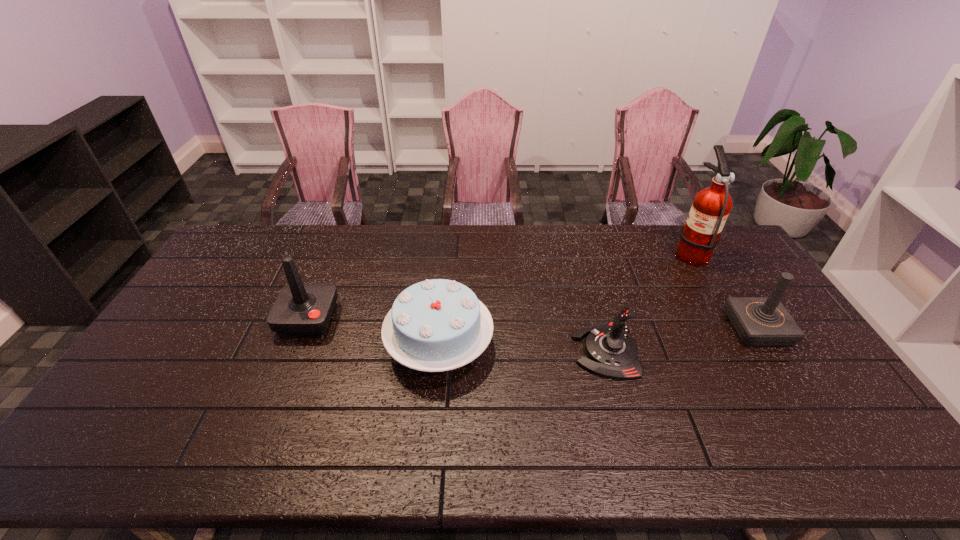
Where is `joystick that is positioned at the right edge`? Image resolution: width=960 pixels, height=540 pixels. joystick that is positioned at the right edge is located at coordinates [759, 321].

Find the location of a particular element. object present at the far right corner is located at coordinates (701, 234).

This screenshot has width=960, height=540. Find the location of `vacant space at the far edge`. vacant space at the far edge is located at coordinates (408, 261).

The height and width of the screenshot is (540, 960). In the image, there is a desktop. Find the location of `vacant space at the near edge`. vacant space at the near edge is located at coordinates (289, 444).

This screenshot has height=540, width=960. Find the location of `vacant space at the left edge of the desktop`. vacant space at the left edge of the desktop is located at coordinates (194, 319).

You are a GUI agent. You are given a task and a screenshot of the screen. Output one action in this format:
    pyautogui.click(x=<x>, y=<y>)
    Task: Click on the vacant position at the right edge of the desktop
    
    Given the screenshot: What is the action you would take?
    pyautogui.click(x=774, y=358)

Find the location of `vacant space at the far left corner of the desktop`. vacant space at the far left corner of the desktop is located at coordinates (256, 232).

Find the location of a particular element. empty space between the leftmost joystick and the birthday cake is located at coordinates (373, 332).

The height and width of the screenshot is (540, 960). What are the coordinates of `vacant region between the leftmost joystick and the fire extinguisher` in the screenshot? It's located at (498, 285).

Where is `vacant area that lies between the farthest object and the fourth object from right to left`? Image resolution: width=960 pixels, height=540 pixels. vacant area that lies between the farthest object and the fourth object from right to left is located at coordinates (564, 299).